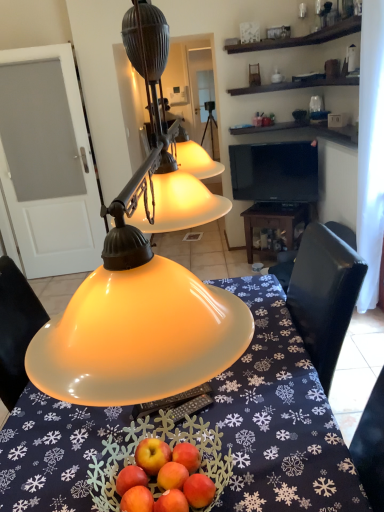
What is the approximate width of black glossy tv at upper center?

black glossy tv at upper center is 5.55 inches in width.

What do you see at coordinates (199, 425) in the screenshot? I see `translucent glass bowl at center` at bounding box center [199, 425].

Locate an element on the screen. This screenshot has height=512, width=384. matte yellow glass lampshade at center is located at coordinates (143, 278).

The height and width of the screenshot is (512, 384). Find the location of `black glossy tv at upper center`. black glossy tv at upper center is located at coordinates (275, 172).

In the scene shown: From a real-world perspective, relative to wooden table at center, is translucent glass bowl at center vertically above or below?

In terms of real-world spatial position, translucent glass bowl at center is above wooden table at center.

Is translucent glass bowl at center placed right next to wooden table at center?

There is a gap between translucent glass bowl at center and wooden table at center.

Is translucent glass bowl at center bigger than wooden table at center?

Yes.

From the image's perspective, is translucent glass bowl at center above or below wooden table at center?

translucent glass bowl at center is situated lower than wooden table at center in the image.

Considering the relative sizes of matte yellow glass lampshade at center and translucent glass bowl at center in the image provided, is matte yellow glass lampshade at center thinner than translucent glass bowl at center?

Indeed, matte yellow glass lampshade at center has a lesser width compared to translucent glass bowl at center.

From a real-world perspective, is matte yellow glass lampshade at center positioned above or below translucent glass bowl at center?

matte yellow glass lampshade at center is situated higher than translucent glass bowl at center in the real world.

Is matte yellow glass lampshade at center behind translucent glass bowl at center?

No, it is in front of translucent glass bowl at center.

Who is taller, matte yellow glass lampshade at center or translucent glass bowl at center?

translucent glass bowl at center.

Is translucent glass bowl at center thinner than black glossy tv at upper center?

No, translucent glass bowl at center is not thinner than black glossy tv at upper center.

Locate an element on the screen. The image size is (384, 512). desk below the black glossy tv at upper center (from a real-world perspective) is located at coordinates (199, 425).

Is translucent glass bowl at center not within black glossy tv at upper center?

Yes, translucent glass bowl at center is located beyond the bounds of black glossy tv at upper center.

Which point is more forward, (235, 367) or (264, 166)?

Positioned in front is point (235, 367).

Based on the photo, relative to wooden table at center, is matte yellow glass lampshade at center in front or behind?

matte yellow glass lampshade at center is in front of wooden table at center.

Looking at this image, from their relative heights in the image, would you say matte yellow glass lampshade at center is taller or shorter than wooden table at center?

In the image, matte yellow glass lampshade at center appears to be taller than wooden table at center.

What's the angular difference between matte yellow glass lampshade at center and wooden table at center's facing directions?

They differ by 60.8 degrees in their facing directions.

Does matte yellow glass lampshade at center have a larger size compared to wooden table at center?

Correct, matte yellow glass lampshade at center is larger in size than wooden table at center.

In the scene shown: Can you confirm if matte yellow glass lampshade at center is taller than black glossy tv at upper center?

Correct, matte yellow glass lampshade at center is much taller as black glossy tv at upper center.

Which is in front, matte yellow glass lampshade at center or black glossy tv at upper center?

matte yellow glass lampshade at center is more forward.

Is matte yellow glass lampshade at center looking in the opposite direction of black glossy tv at upper center?

matte yellow glass lampshade at center does not have its back to black glossy tv at upper center.

From a real-world perspective, who is located higher, matte yellow glass lampshade at center or black glossy tv at upper center?

matte yellow glass lampshade at center.

Does black glossy tv at upper center have a larger size compared to translucent glass bowl at center?

No, black glossy tv at upper center is not bigger than translucent glass bowl at center.

Would you say black glossy tv at upper center is a long distance from translucent glass bowl at center?

black glossy tv at upper center is far away from translucent glass bowl at center.

In terms of width, does black glossy tv at upper center look wider or thinner when compared to translucent glass bowl at center?

In the image, black glossy tv at upper center appears to be more narrow than translucent glass bowl at center.

Is black glossy tv at upper center aimed at translucent glass bowl at center?

Yes, black glossy tv at upper center is turned towards translucent glass bowl at center.

Is wooden table at center thinner than translucent glass bowl at center?

Indeed, wooden table at center has a lesser width compared to translucent glass bowl at center.

Is wooden table at center turned away from translucent glass bowl at center?

That's not correct — wooden table at center is not looking away from translucent glass bowl at center.

How different are the orientations of wooden table at center and translucent glass bowl at center in degrees?

The facing directions of wooden table at center and translucent glass bowl at center are 149 degrees apart.

How much distance is there between wooden table at center and translucent glass bowl at center?

wooden table at center is 7.27 feet from translucent glass bowl at center.

You are a GUI agent. You are given a task and a screenshot of the screen. Output one action in this format:
    pyautogui.click(x=<x>, y=<y>)
    Task: Click on the desk lying in front of the wooden table at center
    
    Given the screenshot: What is the action you would take?
    pyautogui.click(x=199, y=425)

Find the location of a particular element. The image size is (384, 512). lamp on the left of translucent glass bowl at center is located at coordinates click(x=143, y=278).

From the picture: Based on their spatial positions, is translucent glass bowl at center or wooden table at center closer to black glossy tv at upper center?

Among the two, wooden table at center is located nearer to black glossy tv at upper center.

Looking at the image, which one is located further to matte yellow glass lampshade at center, translucent glass bowl at center or wooden table at center?

Based on the image, wooden table at center appears to be further to matte yellow glass lampshade at center.

Consider the image. From the image, which object appears to be farther from matte yellow glass lampshade at center, black glossy tv at upper center or wooden table at center?

black glossy tv at upper center is further to matte yellow glass lampshade at center.

Estimate the real-world distances between objects in this image. Which object is further from translucent glass bowl at center, wooden table at center or black glossy tv at upper center?

black glossy tv at upper center is positioned further to the anchor translucent glass bowl at center.

When comparing their distances from wooden table at center, does translucent glass bowl at center or matte yellow glass lampshade at center seem further?

matte yellow glass lampshade at center lies further to wooden table at center than the other object.

From the image, which object appears to be farther from black glossy tv at upper center, wooden table at center or translucent glass bowl at center?

The object further to black glossy tv at upper center is translucent glass bowl at center.

Which object lies nearer to the anchor point wooden table at center, black glossy tv at upper center or translucent glass bowl at center?

black glossy tv at upper center is positioned closer to the anchor wooden table at center.

From the image, which object appears to be farther from wooden table at center, matte yellow glass lampshade at center or translucent glass bowl at center?

matte yellow glass lampshade at center.

You are a GUI agent. You are given a task and a screenshot of the screen. Output one action in this format:
    pyautogui.click(x=<x>, y=<y>)
    Task: Click on the television positioned between translucent glass bowl at center and wooden table at center from near to far
    This screenshot has height=512, width=384.
    Given the screenshot: What is the action you would take?
    pyautogui.click(x=275, y=172)

This screenshot has width=384, height=512. Find the location of `television positioned between matte yellow glass lampshade at center and wooden table at center from near to far`. television positioned between matte yellow glass lampshade at center and wooden table at center from near to far is located at coordinates (275, 172).

The image size is (384, 512). Identify the location of desk between matte yellow glass lampshade at center and black glossy tv at upper center in the front-back direction. (199, 425).

The width and height of the screenshot is (384, 512). Identify the location of desk between matte yellow glass lampshade at center and wooden table at center along the z-axis. (199, 425).